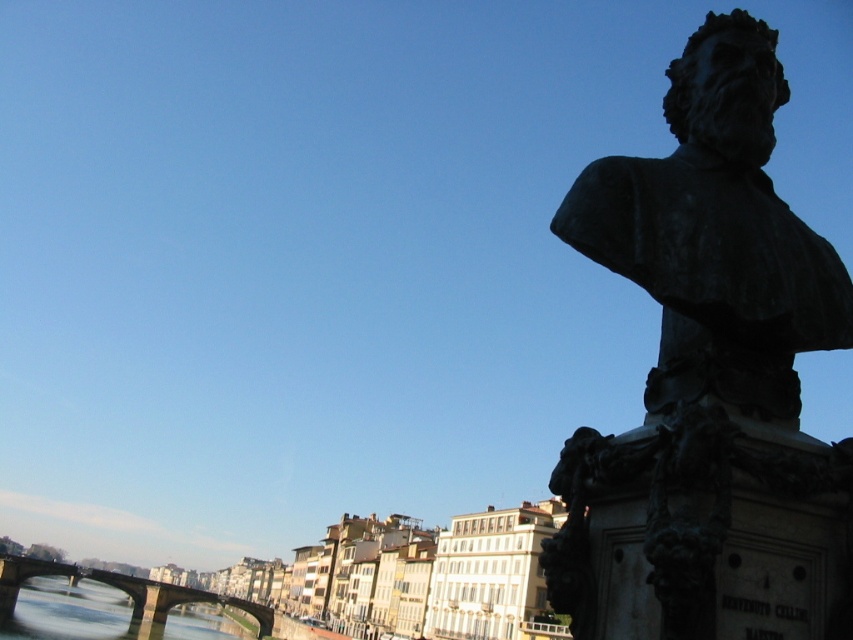
You are an architect analyzing the cityscape. Given the bronze bust at right and the concrete bridge at lower left, which structure is taller?

The bronze bust at right is shorter than the concrete bridge at lower left, so the concrete bridge at lower left is taller.

What object is located at the coordinate point [709,381] in the image?

The bronze bust at right is located at the coordinate point [709,381].

You are an architect analyzing the spatial relationships in this Florentine riverside scene. Given the bronze bust at right and the concrete bridge at lower left, which object occupies more horizontal space in the image?

The concrete bridge at lower left occupies more horizontal space than the bronze bust at right, as the bronze bust at right has a lesser width compared to concrete bridge at lower left.